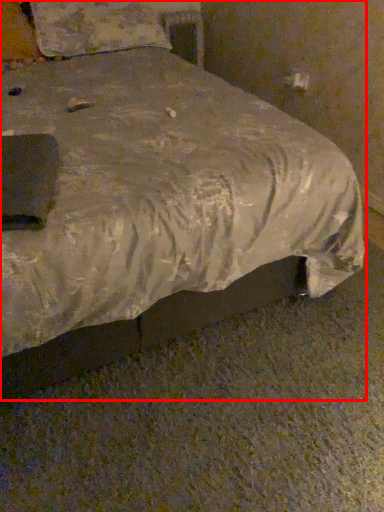
Question: Where is bed (annotated by the red box) located in relation to pillow in the image?

Choices:
 (A) left
 (B) right

Answer: (B)